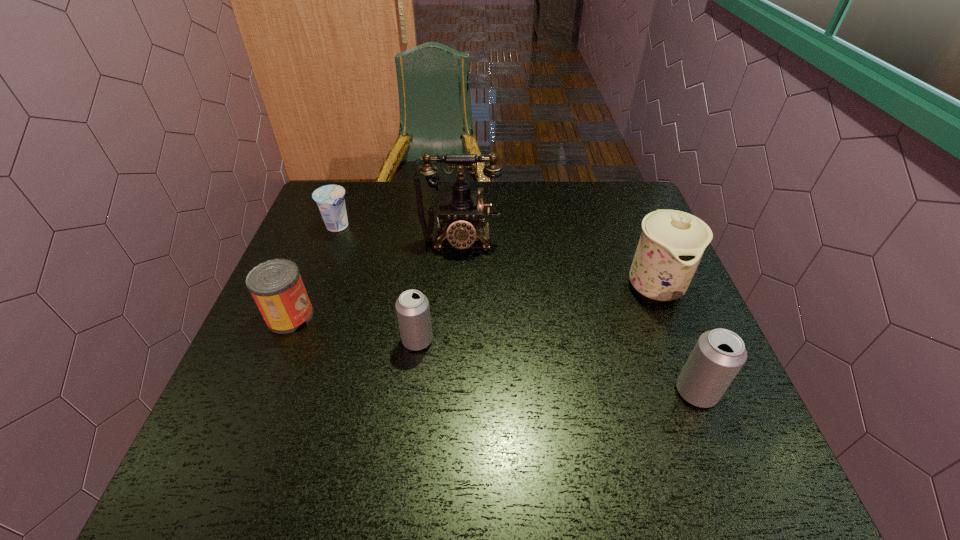
You are a GUI agent. You are given a task and a screenshot of the screen. Output one action in this format:
    pyautogui.click(x=<x>, y=<y>)
    Task: Click on the free spot between the telephone and the chinaware
    This screenshot has height=540, width=960.
    Given the screenshot: What is the action you would take?
    pyautogui.click(x=557, y=262)

Where is `free space that is in between the fifth shortest object and the can`? The height and width of the screenshot is (540, 960). free space that is in between the fifth shortest object and the can is located at coordinates (472, 300).

At what (x,y) coordinates should I click in order to perform the action: click on vacant area between the telephone and the nearest object. Please return your answer as a coordinate pair (x, y). Image resolution: width=960 pixels, height=540 pixels. Looking at the image, I should click on (578, 316).

I want to click on vacant space that is in between the can and the telephone, so click(374, 279).

Where is `vacant area that lies between the chinaware and the nearer beer can`? This screenshot has height=540, width=960. vacant area that lies between the chinaware and the nearer beer can is located at coordinates (675, 338).

You are a GUI agent. You are given a task and a screenshot of the screen. Output one action in this format:
    pyautogui.click(x=<x>, y=<y>)
    Task: Click on the free point between the tallest object and the second tallest object
    This screenshot has height=540, width=960.
    Given the screenshot: What is the action you would take?
    pyautogui.click(x=557, y=262)

Locate an element on the screen. Image resolution: width=960 pixels, height=540 pixels. empty space that is in between the shortest object and the right beer can is located at coordinates (516, 309).

Where is `free space between the yogurt and the farther beer can`? The width and height of the screenshot is (960, 540). free space between the yogurt and the farther beer can is located at coordinates (377, 284).

Where is `vacant space in between the chinaware and the yogurt`? The width and height of the screenshot is (960, 540). vacant space in between the chinaware and the yogurt is located at coordinates (495, 255).

Find the location of `object that is the fifth closest one to the right beer can`. object that is the fifth closest one to the right beer can is located at coordinates (330, 199).